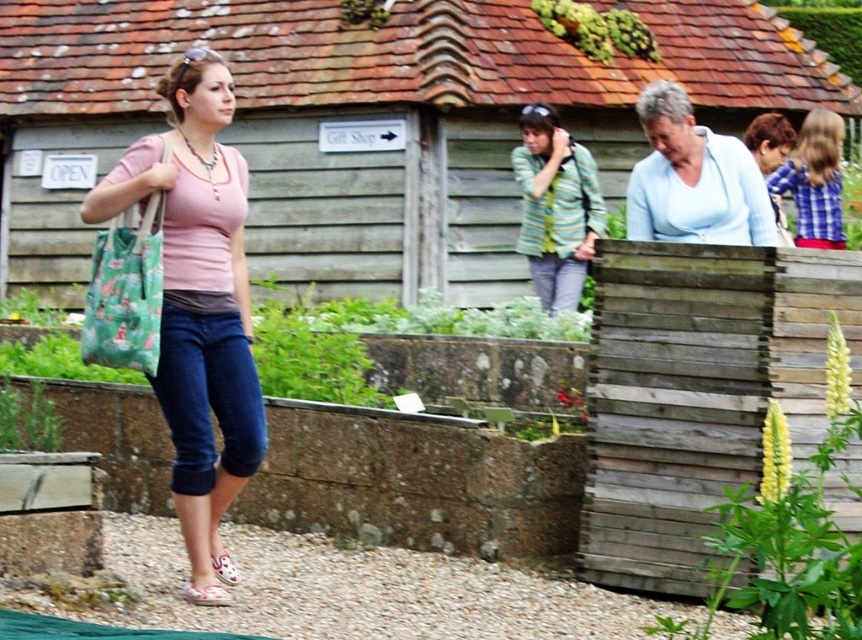
Is point (578, 147) in front of point (829, 147)?

No, (578, 147) is behind (829, 147).

Between striped fabric jacket at center and plaid shirt at upper right, which one has less height?

With less height is plaid shirt at upper right.

Is point (557, 189) closer to camera compared to point (804, 220)?

No, it is not.

The width and height of the screenshot is (862, 640). In order to click on striped fabric jacket at center in this screenshot , I will do click(x=554, y=208).

Based on the photo, between wooden fence at center and plaid shirt at upper right, which one is positioned lower?

Positioned lower is plaid shirt at upper right.

Who is taller, wooden fence at center or plaid shirt at upper right?

Standing taller between the two is wooden fence at center.

Who is more forward, [119,28] or [781,172]?

Point [781,172] is more forward.

Find the location of `wooden fence at center`. wooden fence at center is located at coordinates (364, 124).

Between wooden fence at center and striped fabric jacket at center, which one appears on the left side from the viewer's perspective?

wooden fence at center is more to the left.

What do you see at coordinates (364, 124) in the screenshot? I see `wooden fence at center` at bounding box center [364, 124].

This screenshot has height=640, width=862. I want to click on wooden fence at center, so click(364, 124).